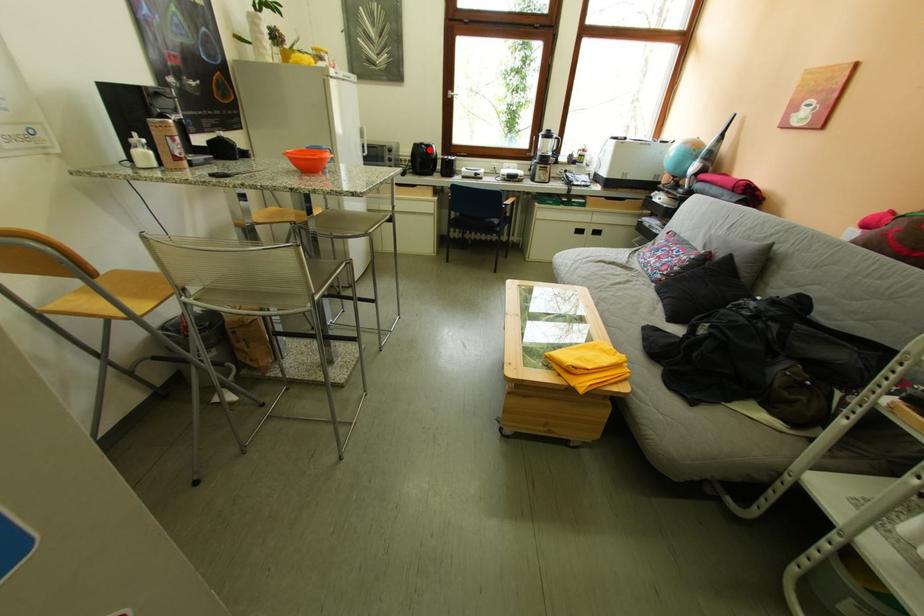
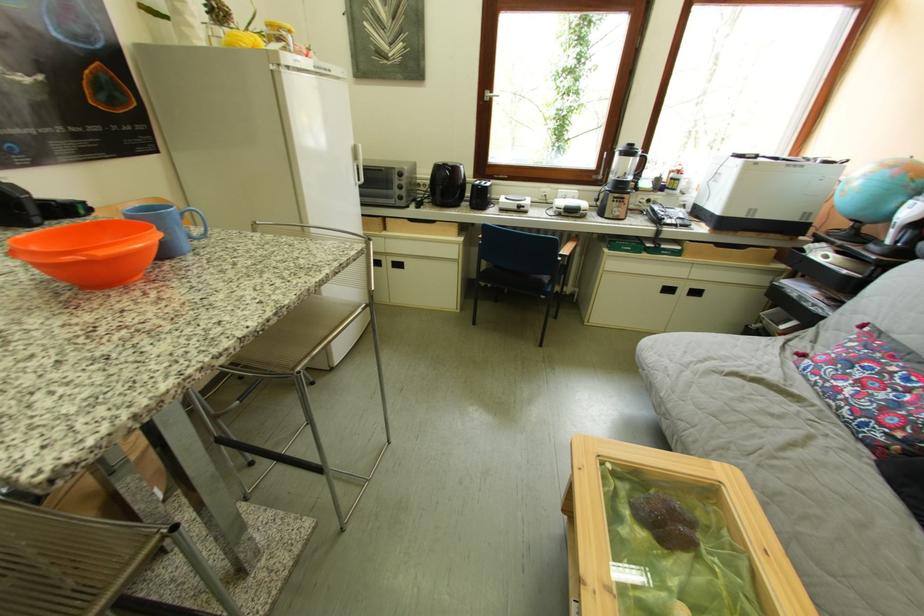
Where in the second image is the point corresponding to the highlighted location from the first image?

(451, 171)